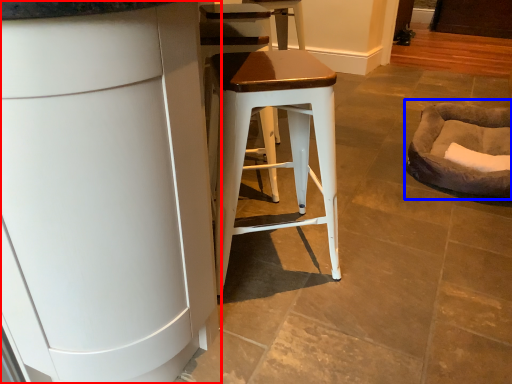
Question: Which point is further to the camera, cabinetry (highlighted by a red box) or bean bag chair (highlighted by a blue box)?

Choices:
 (A) cabinetry
 (B) bean bag chair

Answer: (B)